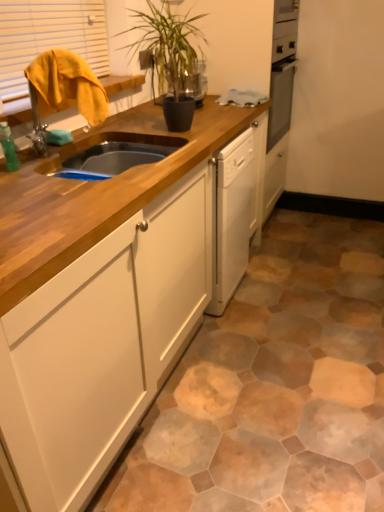
Locate an element on the screen. free area below green leafy plant at upper center (from a real-world perspective) is located at coordinates (188, 124).